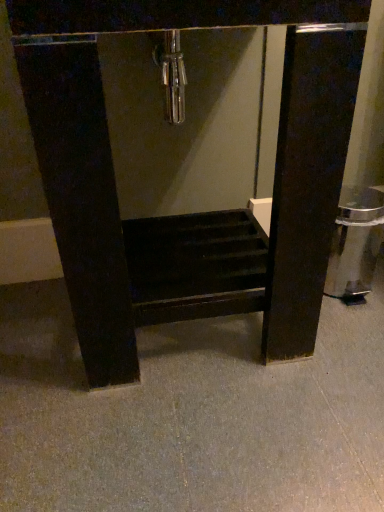
What do you see at coordinates (114, 175) in the screenshot? I see `matte black shelf at center` at bounding box center [114, 175].

What is the approximate height of matte black shelf at center?

28.40 inches.

Locate an element on the screen. Image resolution: width=384 pixels, height=512 pixels. matte black shelf at center is located at coordinates (114, 175).

In order to click on matte black shelf at center in this screenshot , I will do pos(114,175).